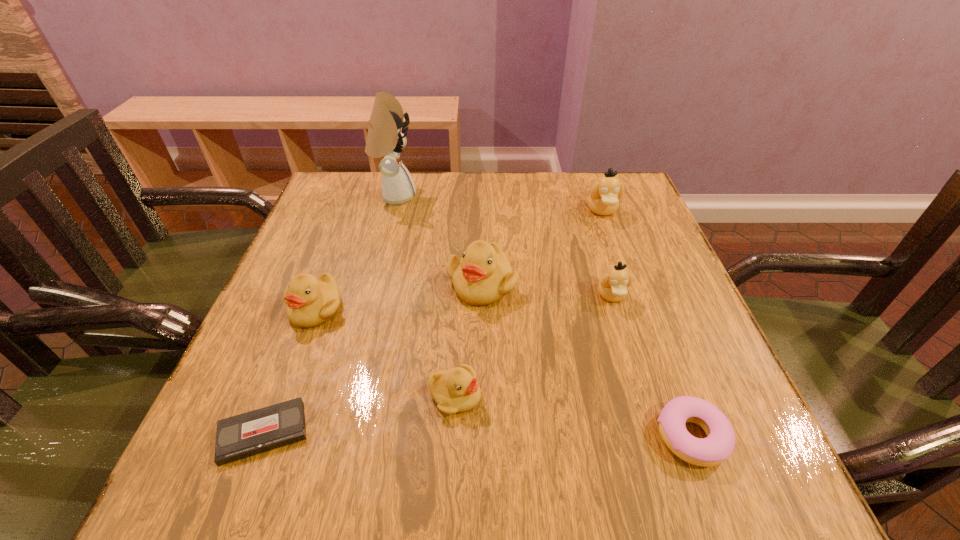
You are a GUI agent. You are given a task and a screenshot of the screen. Output one action in this format:
    pyautogui.click(x=<x>, y=<y>)
    Task: Click on the object that ranks as the fourth closest to the doughnut
    This screenshot has width=960, height=540.
    Given the screenshot: What is the action you would take?
    pyautogui.click(x=603, y=199)

Locate an element on the screen. duckling that is the second closest one to the farthest duckling is located at coordinates (483, 276).

Locate which duckling is the third closest to the farthest duckling. Please provide its 2D coordinates. Your answer should be formatted as a tuple, i.e. [(x, y)], where the tuple contains the x and y coordinates of a point satisfying the conditions above.

[(455, 391)]

Identify which yellow duckling is located as the third nearest to the videotape. Please provide its 2D coordinates. Your answer should be formatted as a tuple, i.e. [(x, y)], where the tuple contains the x and y coordinates of a point satisfying the conditions above.

[(483, 276)]

Identify the location of yellow duckling that is the second closest to the shortest duckling. The width and height of the screenshot is (960, 540). (310, 301).

Identify the location of free space that satisfies the following two spatial constraints: 1. on the face of the farther tan duckling; 2. on the front-facing side of the nearest yellow duckling. (668, 395).

Where is `free location that satisfies the following two spatial constraints: 1. at the front face of the doll; 2. on the front-facing side of the leftmost yellow duckling`? The width and height of the screenshot is (960, 540). free location that satisfies the following two spatial constraints: 1. at the front face of the doll; 2. on the front-facing side of the leftmost yellow duckling is located at coordinates (367, 308).

Identify the location of free space that satisfies the following two spatial constraints: 1. on the face of the doughnut; 2. on the right side of the smaller tan duckling. This screenshot has height=540, width=960. (655, 436).

You are a GUI agent. You are given a task and a screenshot of the screen. Output one action in this format:
    pyautogui.click(x=<x>, y=<y>)
    Task: Click on the free location that satisfies the following two spatial constraints: 1. at the front face of the doll; 2. on the right side of the pink doughnut
    
    Given the screenshot: What is the action you would take?
    pyautogui.click(x=333, y=436)

At what (x,y) coordinates should I click in order to perform the action: click on vacant region that satisfies the following two spatial constraints: 1. on the front-facing side of the pink doughnut; 2. on the right side of the leftmost yellow duckling. Please return your answer as a coordinate pair (x, y). This screenshot has height=540, width=960. Looking at the image, I should click on (268, 436).